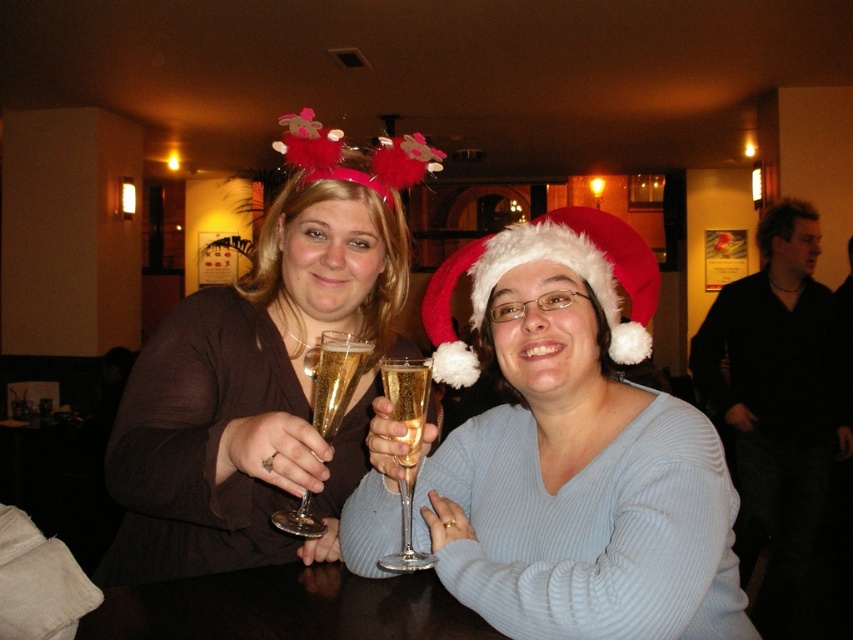
You are a bartender who needs to place a 3.5 inch wide coaster under the gold liquid champagne at center and the translucent glass champagne at center. Can both items fit on the coaster without overlapping?

The gold liquid champagne at center and the translucent glass champagne at center are 2.58 inches apart. Since the coaster is 3.5 inches wide, there is enough space to place both items on the coaster without overlapping as the distance between them is less than the coaster width.

You are a photographer adjusting your camera to focus on two points in the image. The first point is labeled as point (206,563) and the second is point (581,252). Since you can only focus on one point at a time, which point should you choose to ensure the other point remains in focus if you want the closest object to the camera to be sharp?

You should focus on point (206,563) because it is closer to the camera than point (581,252). By focusing on the closer point, the depth of field may also keep the farther point in focus.